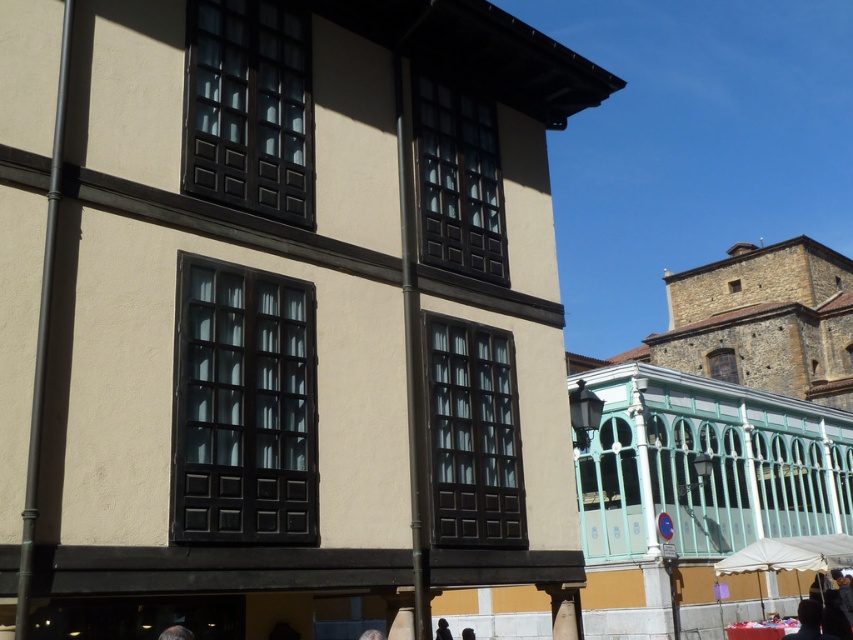
From the picture: You are a photographer trying to capture the teal building with its columns. You notice gray hair at lower left and black fabric at center in your frame. Which object should you adjust your camera to focus on if you want to highlight the larger one?

The black fabric at center is larger than the gray hair at lower left, so you should focus on the black fabric at center to highlight the larger object.

You are standing in front of the beige building with dark wooden windows and the teal building with arched windows. You notice a gray hair at lower left and a black fabric at center. Which object is nearer to you?

The gray hair at lower left is closer to the viewer than the black fabric at center.